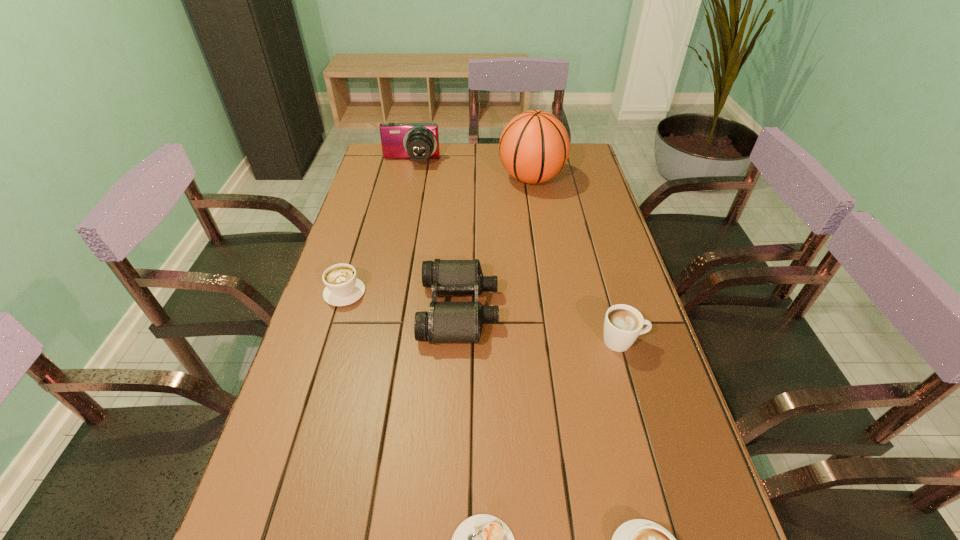
This screenshot has width=960, height=540. I want to click on free space located to the right of the leftmost cappuccino's handle, so click(x=353, y=263).

At what (x,y) coordinates should I click in order to perform the action: click on vacant area situated to the right of the leftmost cappuccino's handle. Please return your answer as a coordinate pair (x, y). Image resolution: width=960 pixels, height=540 pixels. Looking at the image, I should click on (356, 254).

At what (x,y) coordinates should I click in order to perform the action: click on basketball positioned at the far edge. Please return your answer as a coordinate pair (x, y). This screenshot has width=960, height=540. Looking at the image, I should click on (534, 146).

What are the coordinates of `camera that is at the far edge` in the screenshot? It's located at (418, 141).

Identify the location of camera situated at the left edge. Image resolution: width=960 pixels, height=540 pixels. (418, 141).

Where is `cappuccino situated at the left edge`? Image resolution: width=960 pixels, height=540 pixels. cappuccino situated at the left edge is located at coordinates (342, 288).

Locate an element on the screen. basketball that is at the right edge is located at coordinates (534, 146).

Locate an element on the screen. The height and width of the screenshot is (540, 960). cappuccino that is positioned at the right edge is located at coordinates (623, 323).

The image size is (960, 540). Find the location of `object that is positioned at the far left corner`. object that is positioned at the far left corner is located at coordinates click(x=418, y=141).

Where is `object present at the far right corner`? object present at the far right corner is located at coordinates (534, 146).